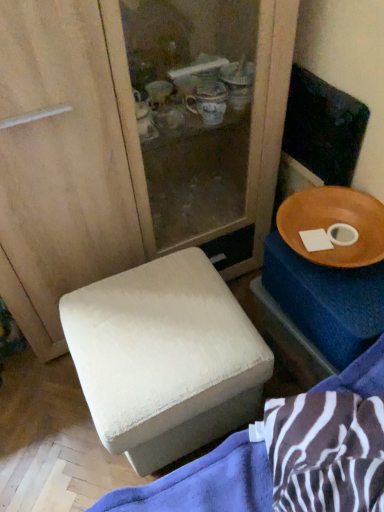
Question: In the image, is white fabric ottoman at lower left positioned in front of or behind wooden tray at right?

Choices:
 (A) front
 (B) behind

Answer: (A)

Question: From a real-world perspective, is white fabric ottoman at lower left above or below wooden tray at right?

Choices:
 (A) above
 (B) below

Answer: (A)

Question: Estimate the real-world distances between objects in this image. Which object is farther from the wooden bowl at right?

Choices:
 (A) wooden tray at right
 (B) white fabric ottoman at lower left

Answer: (B)

Question: Which object is positioned farthest from the white fabric ottoman at lower left?

Choices:
 (A) wooden bowl at right
 (B) wooden tray at right

Answer: (A)